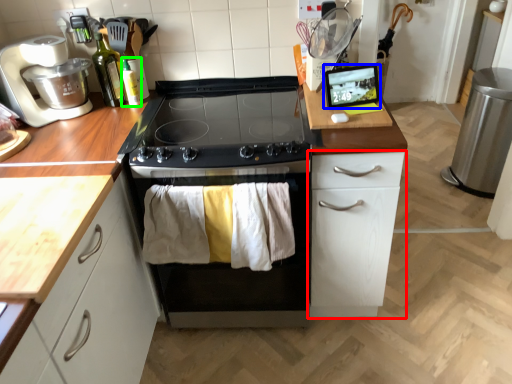
Question: Which object is positioned farthest from cabinetry (highlighted by a red box)? Select from appliance (highlighted by a blue box) and bottle (highlighted by a green box).

Choices:
 (A) appliance
 (B) bottle

Answer: (B)